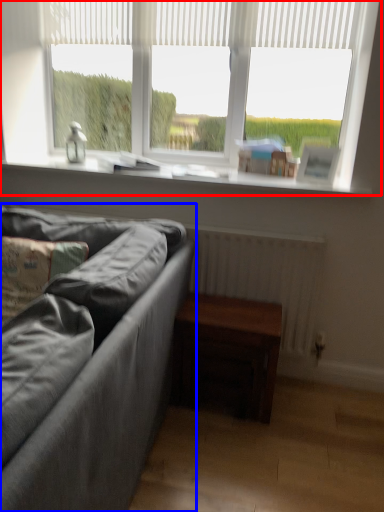
Question: Which object appears closest to the camera in this image, window (highlighted by a red box) or studio couch (highlighted by a blue box)?

Choices:
 (A) window
 (B) studio couch

Answer: (B)